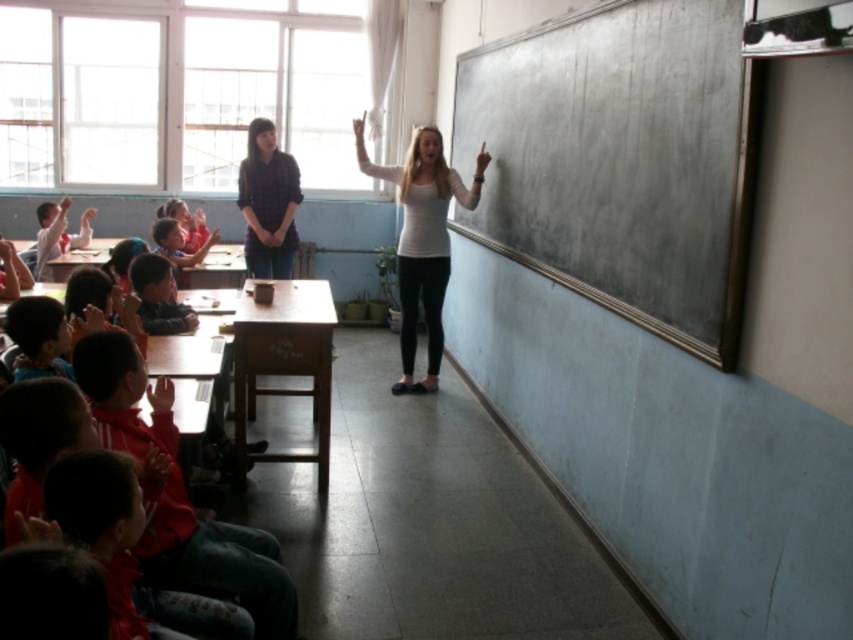
Between point (409, 157) and point (265, 244), which one is positioned in front?

Positioned in front is point (409, 157).

Between white matte shirt at center and matte blue shirt at center, which one is positioned higher?

matte blue shirt at center

Is point (408, 296) behind point (253, 188)?

No, it is in front of (253, 188).

You are a GUI agent. You are given a task and a screenshot of the screen. Output one action in this format:
    pyautogui.click(x=<x>, y=<y>)
    Task: Click on the white matte shirt at center
    The width and height of the screenshot is (853, 640).
    Given the screenshot: What is the action you would take?
    pyautogui.click(x=422, y=240)

Is red jacket at lower left bigger than white matte shirt at center?

Actually, red jacket at lower left might be smaller than white matte shirt at center.

Describe the element at coordinates (181, 497) in the screenshot. I see `red jacket at lower left` at that location.

Image resolution: width=853 pixels, height=640 pixels. Identify the location of red jacket at lower left. (181, 497).

Which is behind, point (552, 176) or point (180, 266)?

The point (180, 266) is behind.

Is point (711, 144) closer to viewer compared to point (154, 225)?

Yes, it is in front of point (154, 225).

Locate an element on the screen. smooth blackboard at right is located at coordinates (621, 161).